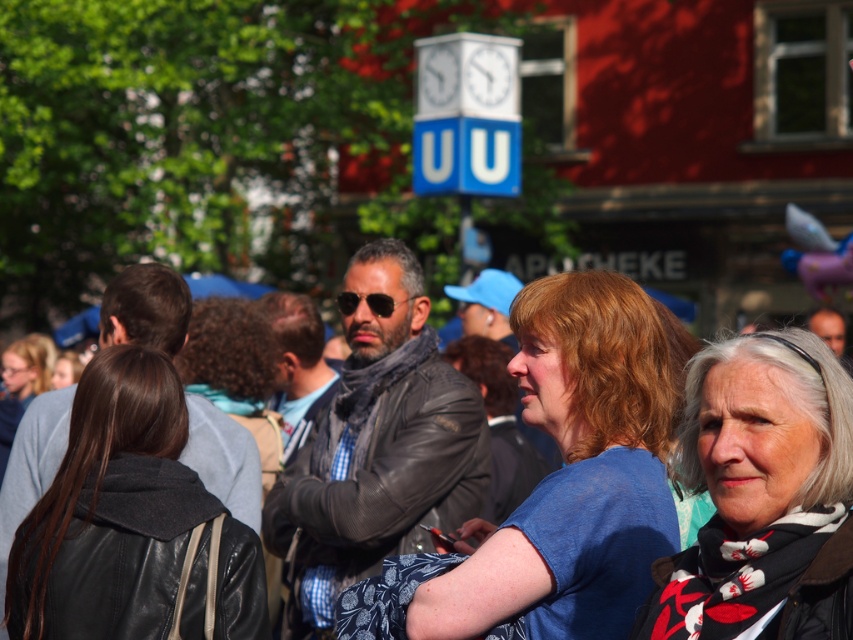
Question: Does blue fabric shirt at center appear on the right side of leather jacket at center?

Choices:
 (A) no
 (B) yes

Answer: (B)

Question: Which point appears farthest from the camera in this image?

Choices:
 (A) (811, 422)
 (B) (566, 374)
 (C) (99, 500)
 (D) (515, 509)

Answer: (D)

Question: Is black leather jacket at left positioned behind leather jacket at center?

Choices:
 (A) no
 (B) yes

Answer: (B)

Question: Among these objects, which one is nearest to the camera?

Choices:
 (A) blue fabric shirt at center
 (B) black leather jacket at left
 (C) leather jacket at center

Answer: (A)

Question: Among these objects, which one is nearest to the camera?

Choices:
 (A) blue fabric shirt at center
 (B) black leather jacket at left
 (C) leather jacket at center
 (D) white printed scarf at center

Answer: (D)

Question: Can you confirm if blue fabric shirt at center is positioned below leather jacket at center?

Choices:
 (A) no
 (B) yes

Answer: (B)